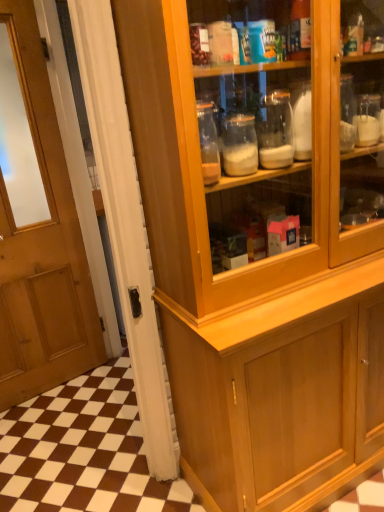
Find the location of a particular element. The image size is (384, 512). vacant space behind wooden door at left is located at coordinates tap(96, 455).